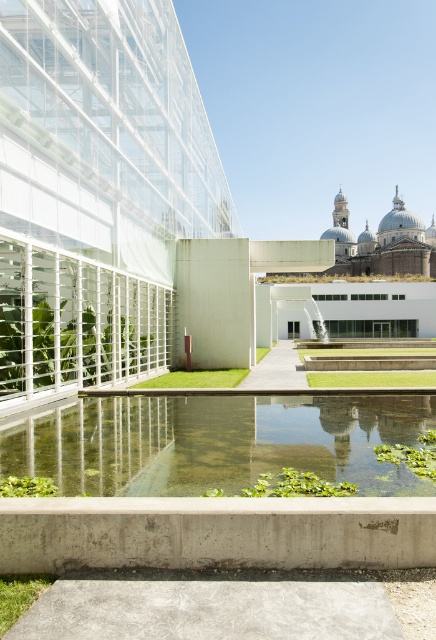
Who is shorter, clear water pond at center or clear glass water feature at center?

clear water pond at center is shorter.

Does clear water pond at center come behind clear glass water feature at center?

No, clear water pond at center is closer to the viewer.

Locate an element on the screen. This screenshot has height=640, width=436. clear water pond at center is located at coordinates (217, 442).